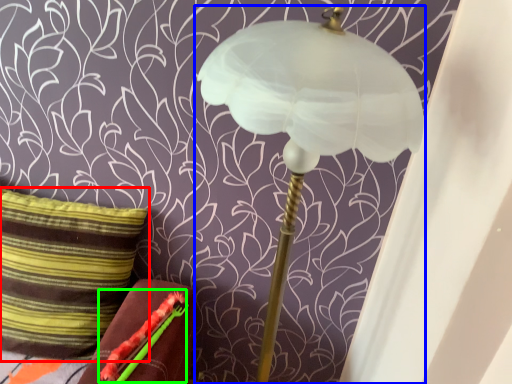
Question: Considering the real-world distances, which object is farthest from pillow (highlighted by a red box)? lamp (highlighted by a blue box) or flower (highlighted by a green box)?

Choices:
 (A) lamp
 (B) flower

Answer: (A)